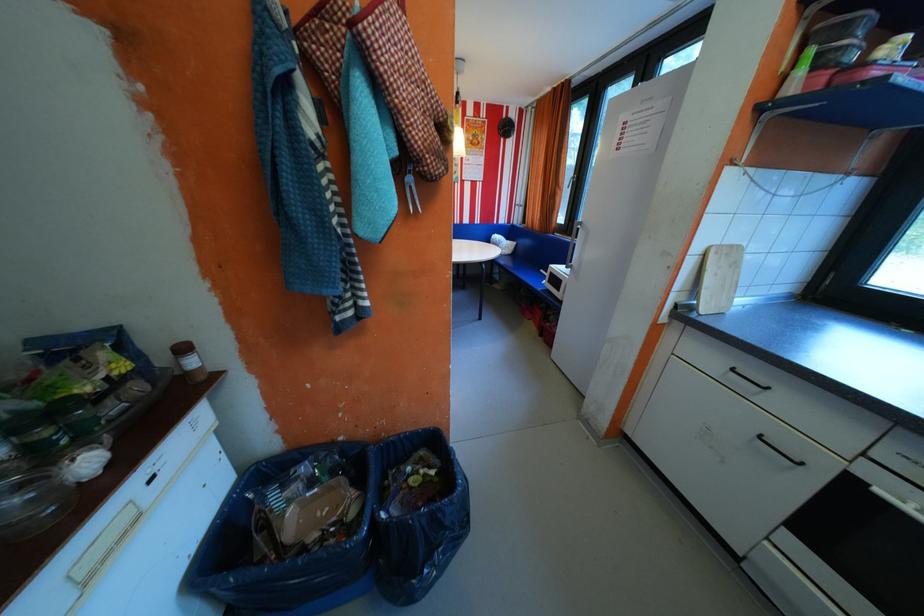
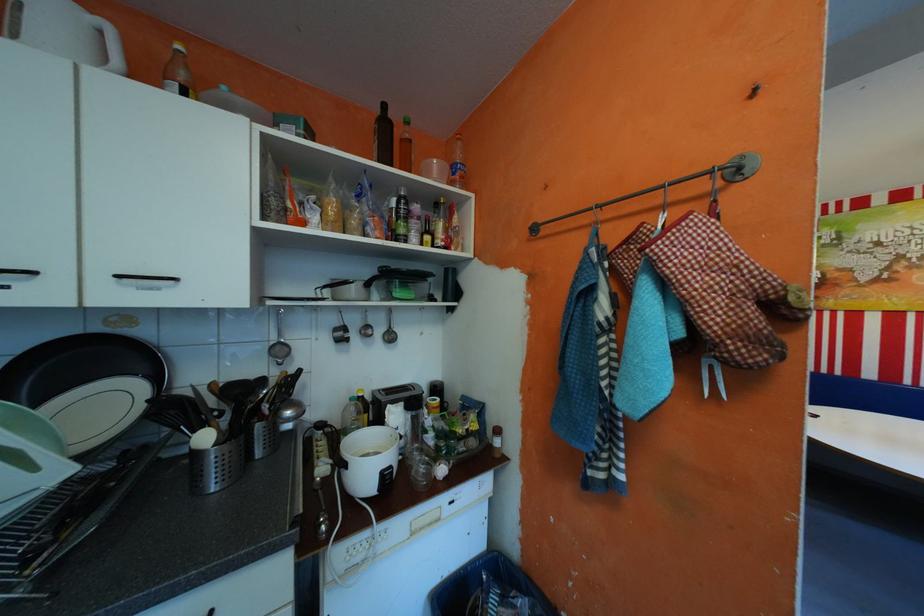
Locate, in the second image, the point that corresponds to [423,123] in the first image.

(715, 310)